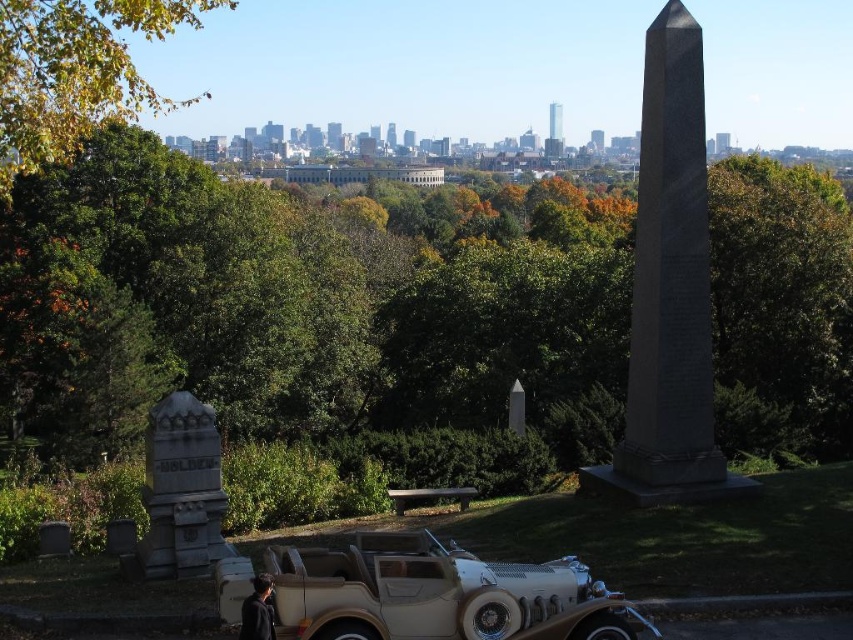
Which is in front, point (61, 80) or point (189, 500)?

Point (189, 500)

Which is in front, point (84, 97) or point (190, 417)?

Point (190, 417)

At what (x,y) coordinates should I click in order to perform the action: click on green leafy tree at upper left. Please return your answer as a coordinate pair (x, y). Looking at the image, I should click on (76, 72).

Is green leafy tree at center closer to camera compared to gray stone monument at lower left?

No.

I want to click on green leafy tree at center, so click(x=289, y=301).

This screenshot has height=640, width=853. I want to click on green leafy tree at center, so click(x=289, y=301).

Consider the image. Which is below, granite obelisk at center or gray stone monument at lower left?

gray stone monument at lower left

Measure the distance between granite obelisk at center and camera.

granite obelisk at center is 18.71 meters away from camera.

Measure the distance between point (628, 417) and camera.

The distance of point (628, 417) from camera is 20.36 meters.

Identify the location of granite obelisk at center. (669, 292).